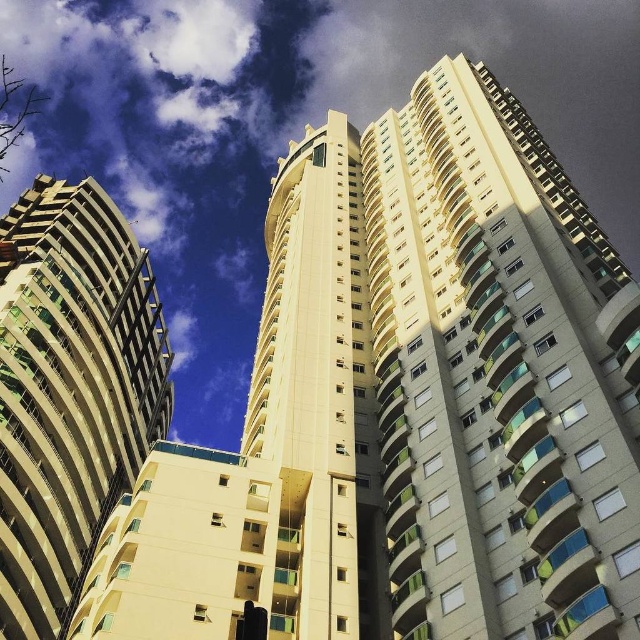
Question: Does matte yellow building at upper right have a greater width compared to beige concrete tower at center?

Choices:
 (A) no
 (B) yes

Answer: (B)

Question: Does matte yellow building at upper right appear on the left side of beige concrete tower at center?

Choices:
 (A) no
 (B) yes

Answer: (A)

Question: Which object appears farthest from the camera in this image?

Choices:
 (A) beige concrete tower at center
 (B) smooth beige building at center
 (C) matte yellow building at upper right

Answer: (A)

Question: Which of the following is the closest to the observer?

Choices:
 (A) beige concrete building at left
 (B) matte yellow building at upper right
 (C) smooth beige building at center
 (D) beige concrete tower at center

Answer: (B)

Question: Which object appears farthest from the camera in this image?

Choices:
 (A) smooth beige building at center
 (B) matte yellow building at upper right
 (C) beige concrete building at left
 (D) beige concrete tower at center

Answer: (C)

Question: Considering the relative positions of beige concrete building at left and beige concrete tower at center in the image provided, where is beige concrete building at left located with respect to beige concrete tower at center?

Choices:
 (A) right
 (B) left

Answer: (B)